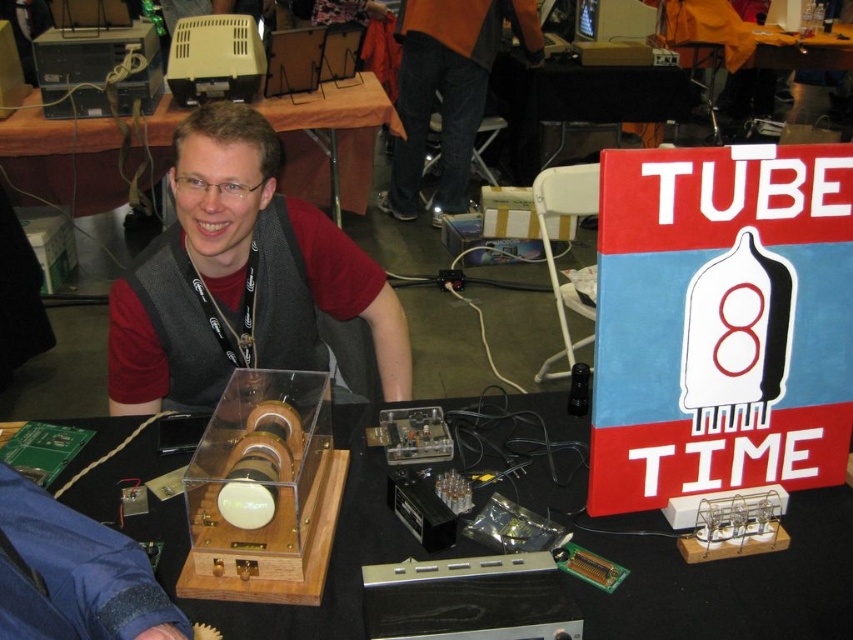
Question: Which object appears closest to the camera in this image?

Choices:
 (A) orange fabric at upper center
 (B) gray fabric vest at upper left
 (C) black plastic table at center
 (D) transparent plastic table at center

Answer: (D)

Question: Is black plastic table at upper center positioned in front of orange fabric at upper center?

Choices:
 (A) yes
 (B) no

Answer: (A)

Question: Is transparent plastic table at center wider than black plastic table at upper center?

Choices:
 (A) no
 (B) yes

Answer: (B)

Question: Estimate the real-world distances between objects in this image. Which object is farther from the gray fabric vest at upper left?

Choices:
 (A) transparent plastic table at center
 (B) black plastic table at upper center

Answer: (B)

Question: Can you confirm if transparent plastic table at center is thinner than gray fabric vest at upper left?

Choices:
 (A) yes
 (B) no

Answer: (B)

Question: Considering the real-world distances, which object is farthest from the gray fabric vest at upper left?

Choices:
 (A) orange fabric at upper center
 (B) black plastic table at center
 (C) transparent plastic table at center

Answer: (B)